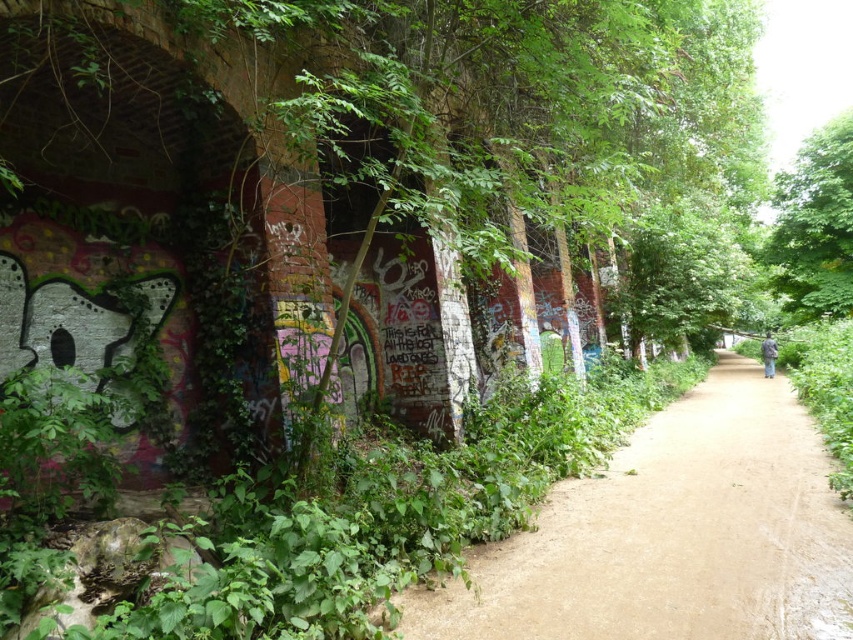
Is brown dirt path at center to the left of green leafy tree at upper right from the viewer's perspective?

Yes, brown dirt path at center is to the left of green leafy tree at upper right.

Is point (560, 518) positioned after point (840, 278)?

No, it is not.

Where is `brown dirt path at center`? brown dirt path at center is located at coordinates (672, 534).

I want to click on brown dirt path at center, so click(x=672, y=534).